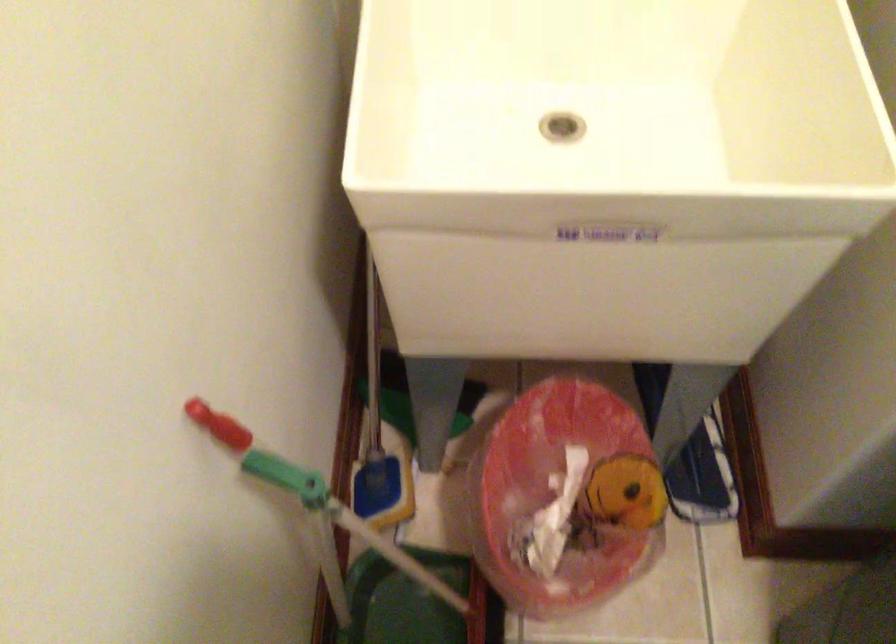
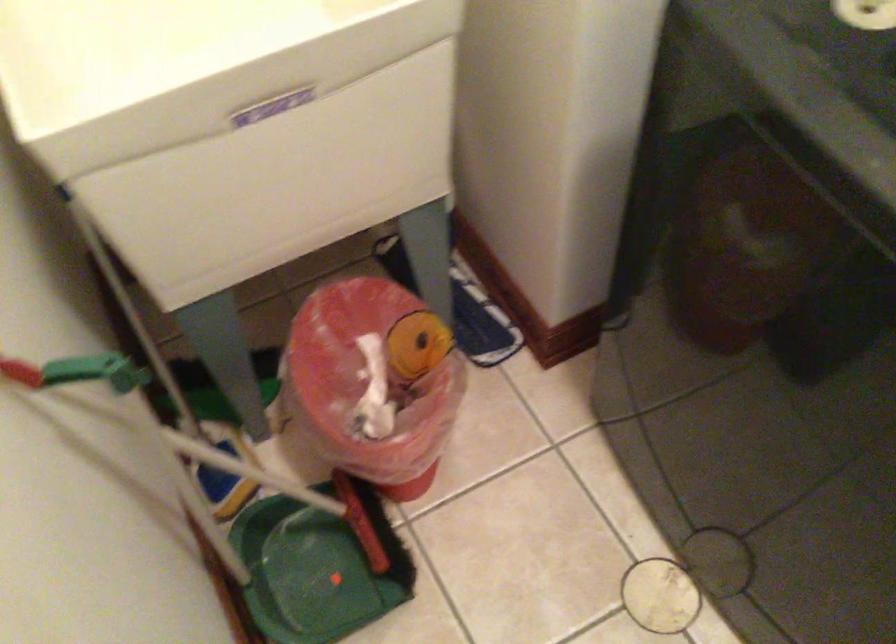
Where in the second image is the point corresponding to point 354,491 from the first image?

(202, 485)